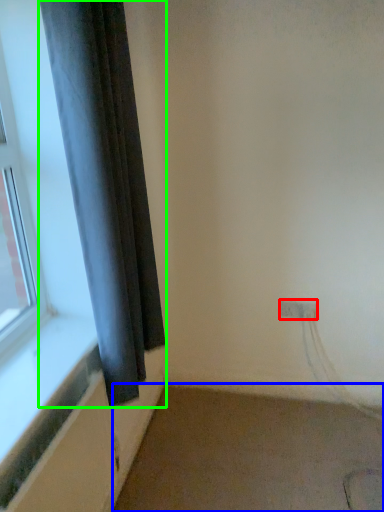
Question: Which object is positioned closest to electric outlet (highlighted by a red box)? Select from plain (highlighted by a blue box) and curtain (highlighted by a green box).

Choices:
 (A) plain
 (B) curtain

Answer: (A)